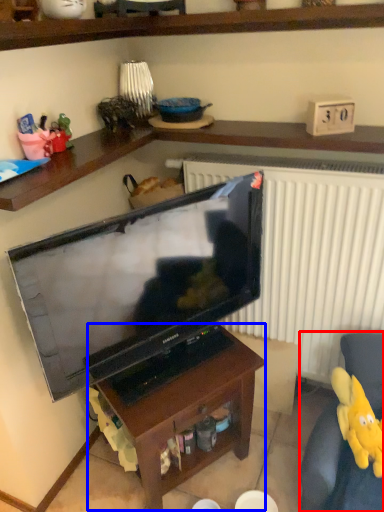
Question: Which object appears farthest to the camera in this image, swivel chair (highlighted by a red box) or table (highlighted by a blue box)?

Choices:
 (A) swivel chair
 (B) table

Answer: (B)